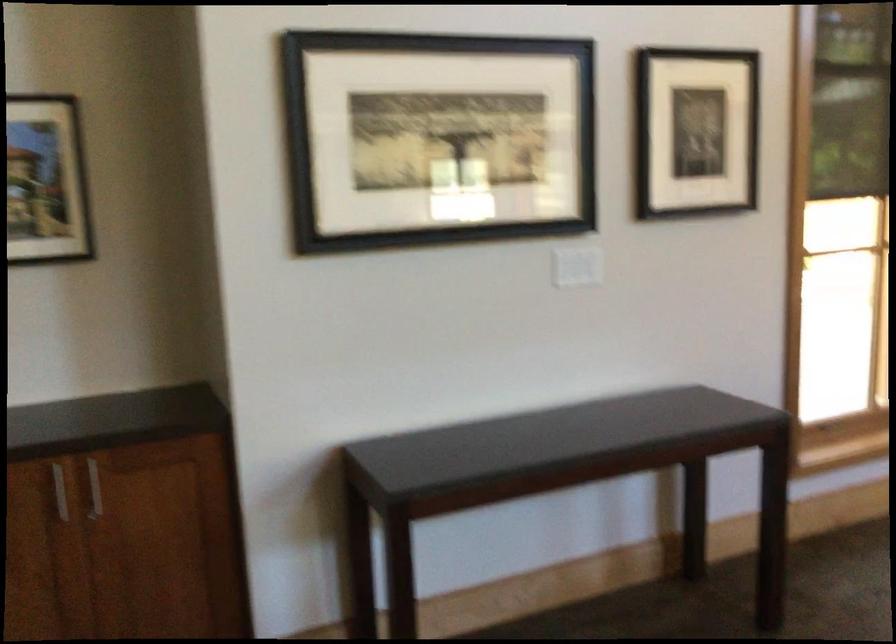
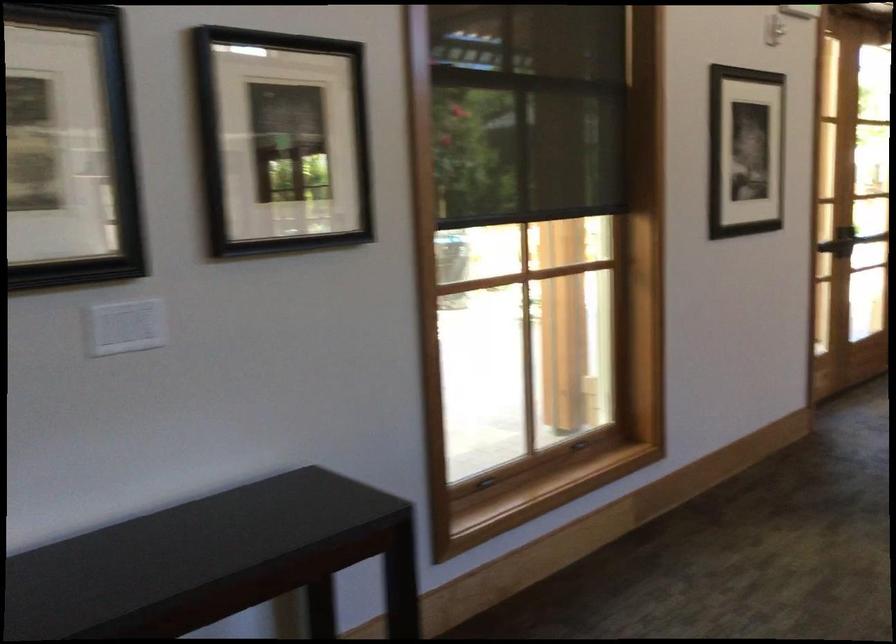
Question: The camera is either moving clockwise (left) or counter-clockwise (right) around the object. The first image is from the beginning of the video and the second image is from the end. Is the camera moving left or right when shooting the video?

Choices:
 (A) Left
 (B) Right

Answer: (A)